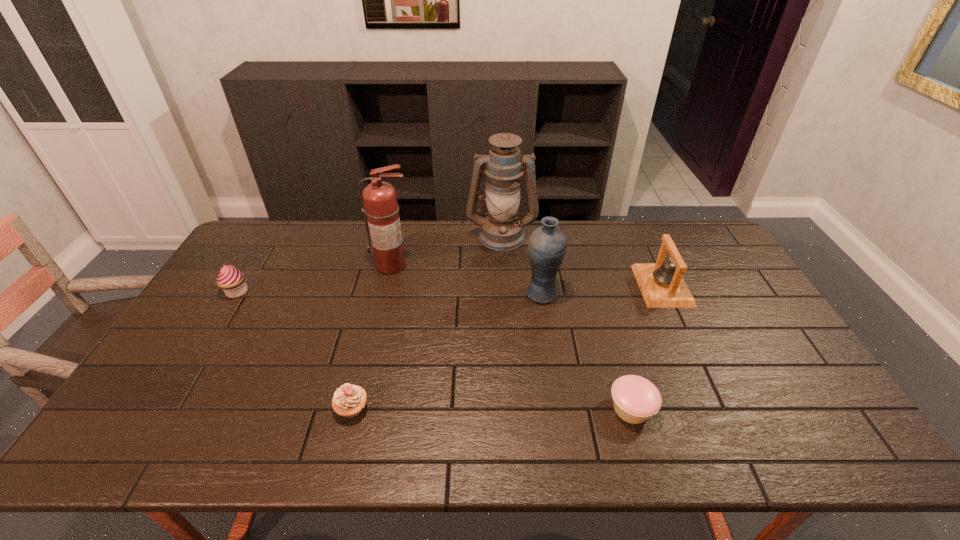
Where is `the farthest object`? This screenshot has height=540, width=960. the farthest object is located at coordinates 501,230.

Where is `fire extinguisher`? This screenshot has width=960, height=540. fire extinguisher is located at coordinates (381, 208).

Locate an element on the screen. the third tallest object is located at coordinates (547, 244).

What are the coordinates of `bell` in the screenshot? It's located at (662, 285).

At what (x,y) coordinates should I click in order to perform the action: click on the rightmost object. Please return your answer as a coordinate pair (x, y). Looking at the image, I should click on (662, 285).

Find the location of a particular element. the farthest cupcake is located at coordinates (231, 280).

Locate an element on the screen. the leftmost cupcake is located at coordinates (231, 280).

At what (x,y) coordinates should I click in order to perform the action: click on the second shortest object. Please return your answer as a coordinate pair (x, y). This screenshot has height=540, width=960. Looking at the image, I should click on (348, 401).

Where is `the second tallest cupcake`? the second tallest cupcake is located at coordinates (348, 401).

At what (x,y) coordinates should I click in order to perform the action: click on the shortest cupcake. Please return your answer as a coordinate pair (x, y). Image resolution: width=960 pixels, height=540 pixels. Looking at the image, I should click on (635, 399).